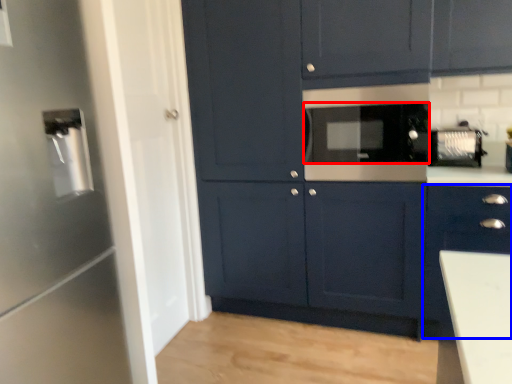
Question: Which object is closer to the camera taking this photo, appliance (highlighted by a red box) or cabinetry (highlighted by a blue box)?

Choices:
 (A) appliance
 (B) cabinetry

Answer: (B)